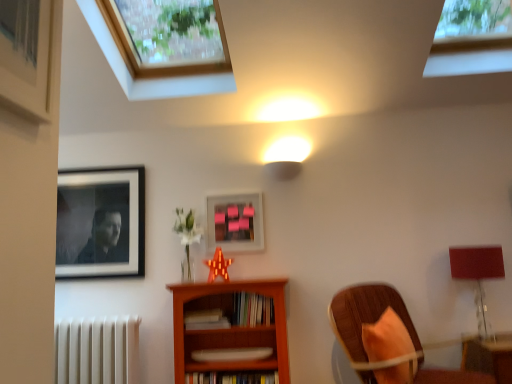
Question: Can you confirm if pink matte picture frame at center, placed as the second picture frame when sorted from left to right, is wider than wooden chair with orange cushion at lower right?

Choices:
 (A) yes
 (B) no

Answer: (B)

Question: Is pink matte picture frame at center, placed as the second picture frame when sorted from left to right, shorter than wooden chair with orange cushion at lower right?

Choices:
 (A) no
 (B) yes

Answer: (B)

Question: Does pink matte picture frame at center, which is counted as the 1th picture frame, starting from the right, have a smaller size compared to wooden chair with orange cushion at lower right?

Choices:
 (A) no
 (B) yes

Answer: (B)

Question: Is pink matte picture frame at center, which is counted as the 1th picture frame, starting from the right, bigger than wooden chair with orange cushion at lower right?

Choices:
 (A) yes
 (B) no

Answer: (B)

Question: Is pink matte picture frame at center, placed as the second picture frame when sorted from left to right, not close to wooden chair with orange cushion at lower right?

Choices:
 (A) no
 (B) yes

Answer: (A)

Question: From the image's perspective, is pink matte picture frame at center, placed as the second picture frame when sorted from left to right, above wooden chair with orange cushion at lower right?

Choices:
 (A) yes
 (B) no

Answer: (A)

Question: Does hardcover books at center, positioned as the third book in bottom-to-top order, appear on the right side of pink matte picture frame at center, which is counted as the 1th picture frame, starting from the right?

Choices:
 (A) no
 (B) yes

Answer: (B)

Question: From the image's perspective, is hardcover books at center, the first book viewed from the top, above pink matte picture frame at center, placed as the second picture frame when sorted from left to right?

Choices:
 (A) no
 (B) yes

Answer: (A)

Question: Is hardcover books at center, the first book viewed from the top, located outside pink matte picture frame at center, which is counted as the 1th picture frame, starting from the right?

Choices:
 (A) yes
 (B) no

Answer: (A)

Question: Can you confirm if hardcover books at center, positioned as the third book in bottom-to-top order, is bigger than pink matte picture frame at center, which is counted as the 1th picture frame, starting from the right?

Choices:
 (A) yes
 (B) no

Answer: (A)

Question: Is hardcover books at center, positioned as the third book in bottom-to-top order, surrounding pink matte picture frame at center, placed as the second picture frame when sorted from left to right?

Choices:
 (A) yes
 (B) no

Answer: (B)

Question: Is hardcover books at center, positioned as the third book in bottom-to-top order, positioned with its back to pink matte picture frame at center, placed as the second picture frame when sorted from left to right?

Choices:
 (A) yes
 (B) no

Answer: (B)

Question: Can you confirm if white matte radiator at lower left is smaller than wooden bookcase at center?

Choices:
 (A) yes
 (B) no

Answer: (A)